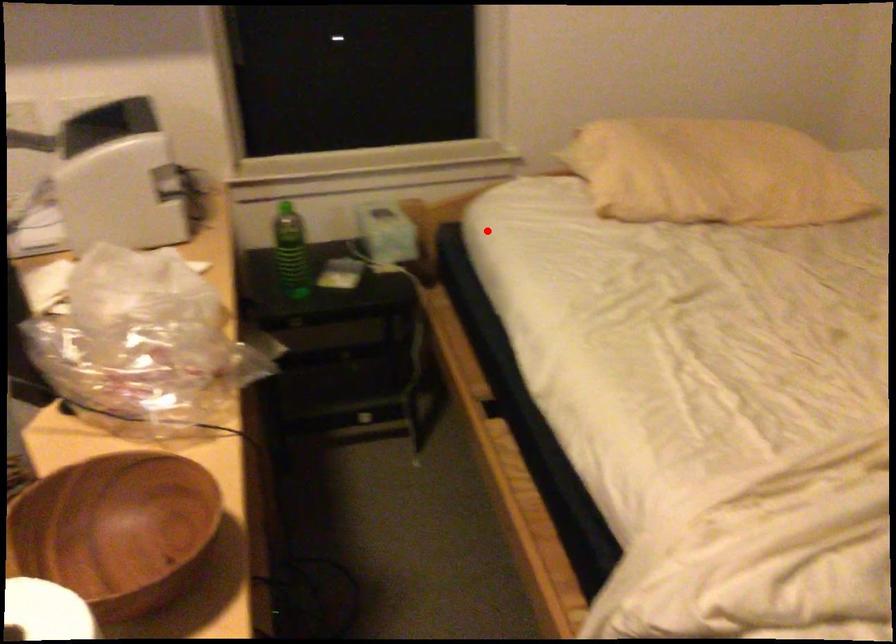
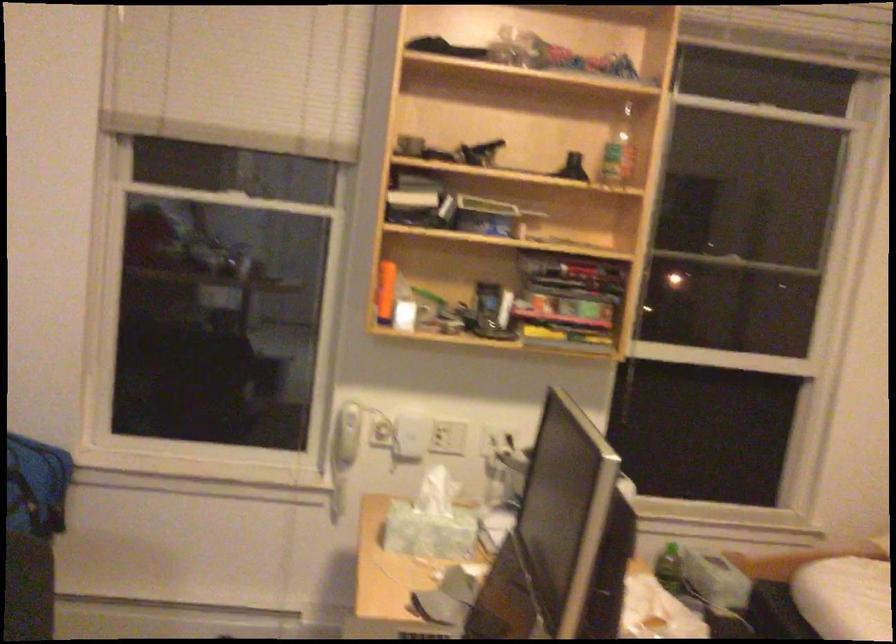
Question: I am providing you with two images of the same scene from different viewpoints. Image1 has a red point marked. In image2, the corresponding 3D location appears at what relative position? Reply with the corresponding letter.

Choices:
 (A) Closer
 (B) Farther

Answer: (B)